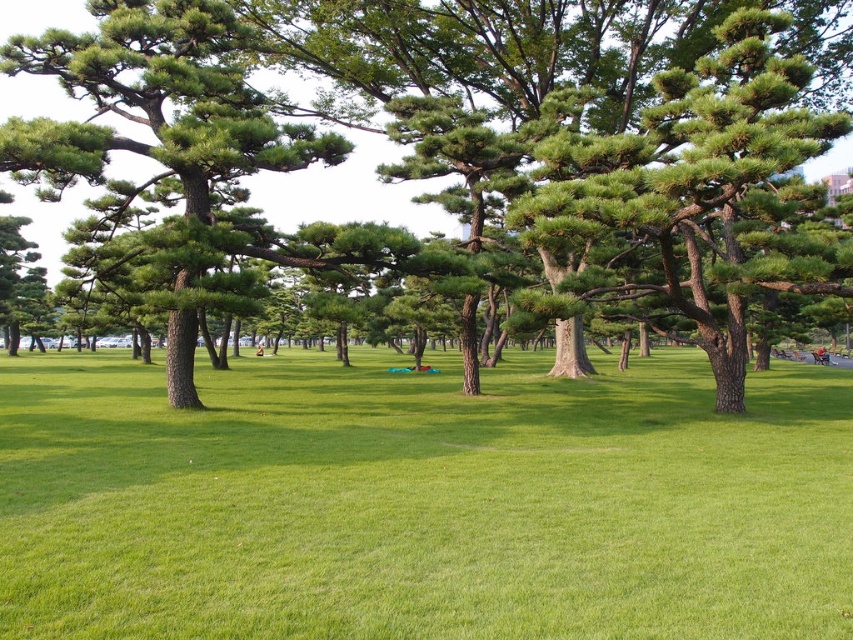
Can you confirm if green grassy field at center is positioned to the left of green textured tree at center?

No, green grassy field at center is not to the left of green textured tree at center.

Which is in front, point (749, 560) or point (791, 99)?

Point (749, 560) is more forward.

Who is more distant from viewer, (41, 388) or (409, 92)?

Point (409, 92)

You are a GUI agent. You are given a task and a screenshot of the screen. Output one action in this format:
    pyautogui.click(x=<x>, y=<y>)
    Task: Click on the green grassy field at center
    The image size is (853, 640).
    Given the screenshot: What is the action you would take?
    pyautogui.click(x=422, y=500)

In the scene shown: Who is more forward, (844, 413) or (138, 28)?

Point (138, 28) is more forward.

Consider the image. Can you confirm if green grassy field at center is taller than green matte tree at center?

In fact, green grassy field at center may be shorter than green matte tree at center.

Where is `green grassy field at center`? The image size is (853, 640). green grassy field at center is located at coordinates (422, 500).

Image resolution: width=853 pixels, height=640 pixels. What are the coordinates of `green grassy field at center` in the screenshot? It's located at (422, 500).

From the picture: Does green textured tree at center appear on the right side of green matte tree at center?

Correct, you'll find green textured tree at center to the right of green matte tree at center.

Does point (822, 129) come in front of point (228, 13)?

Yes, point (822, 129) is in front of point (228, 13).

The height and width of the screenshot is (640, 853). What are the coordinates of `green textured tree at center` in the screenshot? It's located at (479, 132).